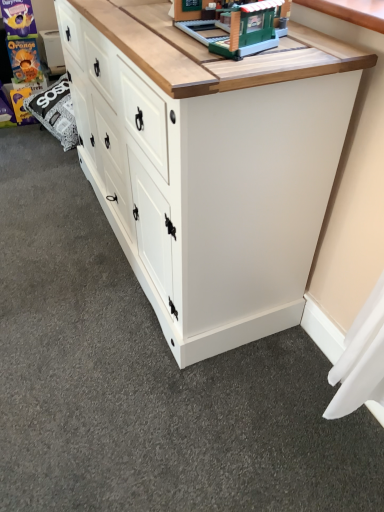
Locate an element on the screen. free location in front of green plastic building at upper center is located at coordinates (229, 64).